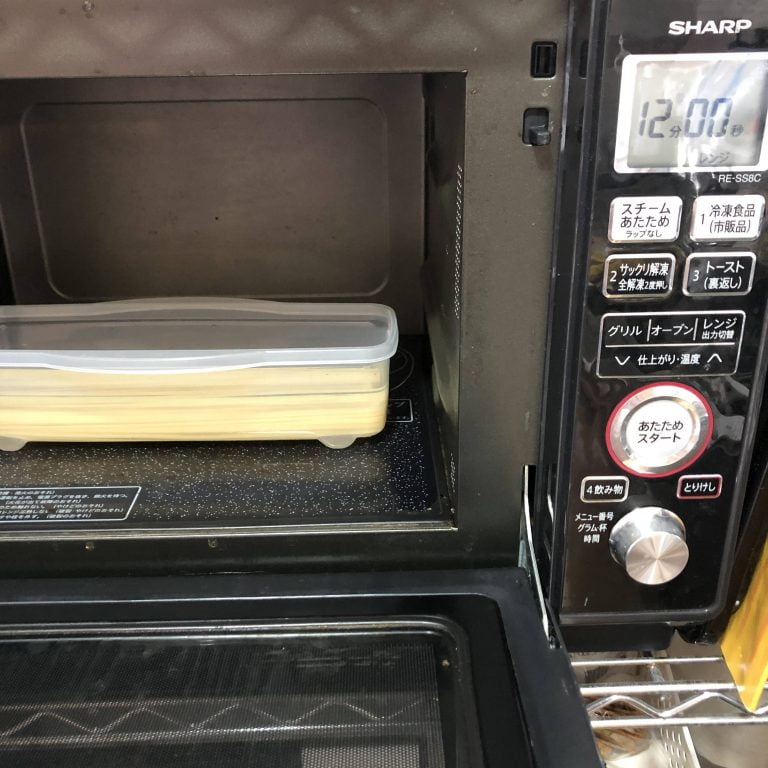
Where is `metal knob`? The width and height of the screenshot is (768, 768). metal knob is located at coordinates (656, 560).